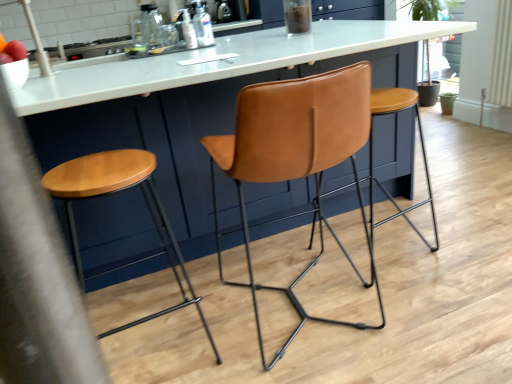
Find the location of `free region under matte brown stool at center, which is counted as the first stool, starting from the left (from a real-world perspective)`. free region under matte brown stool at center, which is counted as the first stool, starting from the left (from a real-world perspective) is located at coordinates (162, 352).